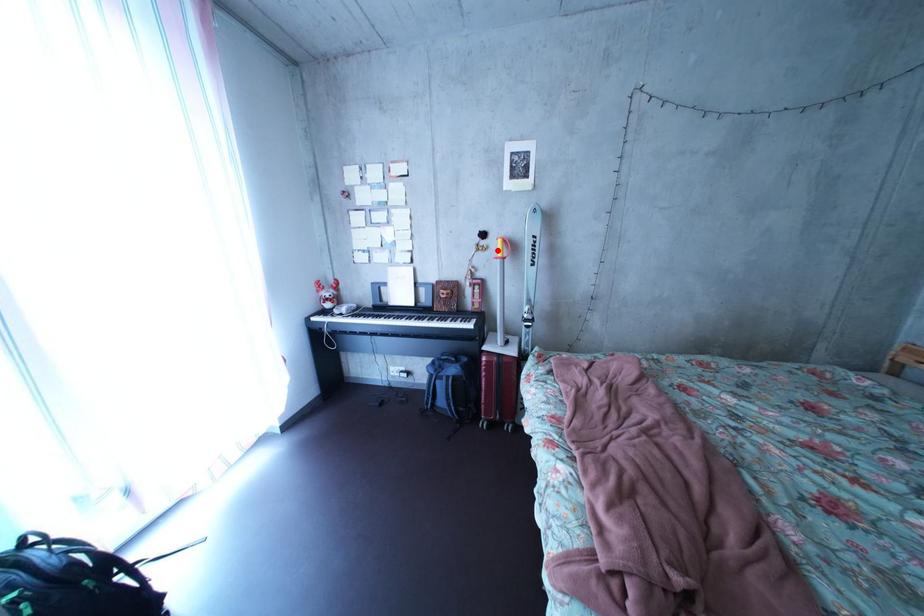
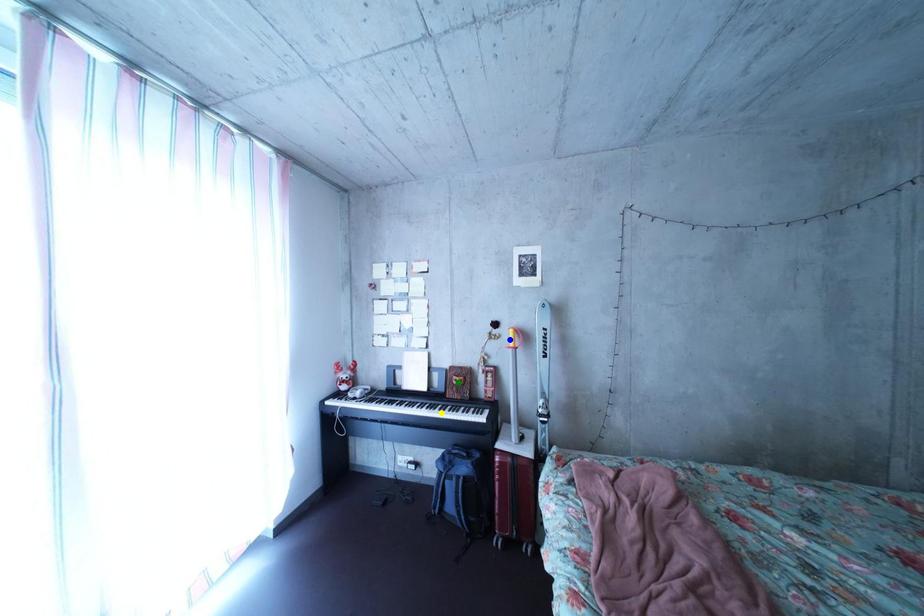
Question: I am providing you with two images of the same scene from different viewpoints. A red point is marked on the first image. You are given multiple points on the second image. Which mark in image 2 goes with the point in image 1?

Choices:
 (A) green point
 (B) yellow point
 (C) blue point

Answer: (C)